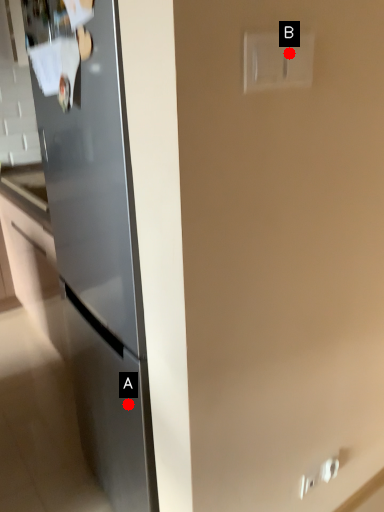
Question: Two points are circled on the image, labeled by A and B beside each circle. Which point is closer to the camera?

Choices:
 (A) A is closer
 (B) B is closer

Answer: (B)